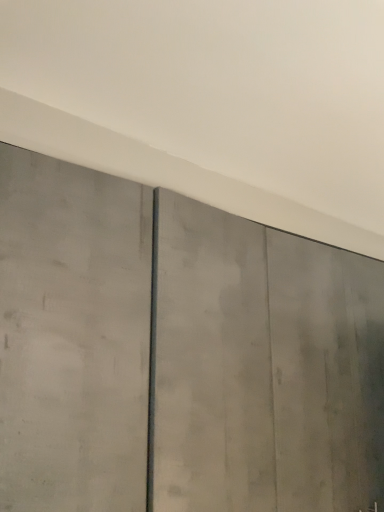
Measure the distance between concrete textured door at center and camera.

A distance of 67.89 centimeters exists between concrete textured door at center and camera.

I want to click on concrete textured door at center, so click(179, 354).

What do you see at coordinates (179, 354) in the screenshot?
I see `concrete textured door at center` at bounding box center [179, 354].

In order to click on concrete textured door at center in this screenshot , I will do `click(179, 354)`.